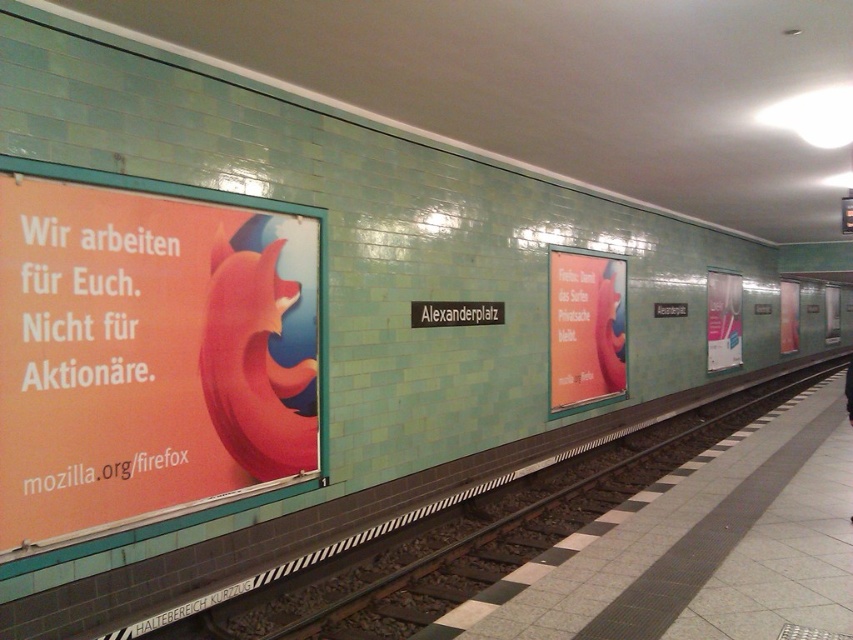
You are a commuter standing on the smooth concrete platform at center. You want to read the text on the white glossy poster at right. Which direction should you move to face the poster?

The smooth concrete platform at center is positioned on the left side of the white glossy poster at right, so you should move to your right to face the poster.

You are a subway passenger trying to find a place to stand while waiting for the train. You notice the matte pink poster at center and the smooth concrete platform at center. Which one would you choose to stand on for better stability?

The smooth concrete platform at center is a better choice for standing because it occupies more space than the matte pink poster at center, providing a larger and more stable area to stand on.

You are a subway passenger trying to read the matte pink poster at center while standing on the smooth concrete platform at center. Considering their sizes, which object is narrower?

The matte pink poster at center is thinner than the smooth concrete platform at center, so the matte pink poster at center is narrower.